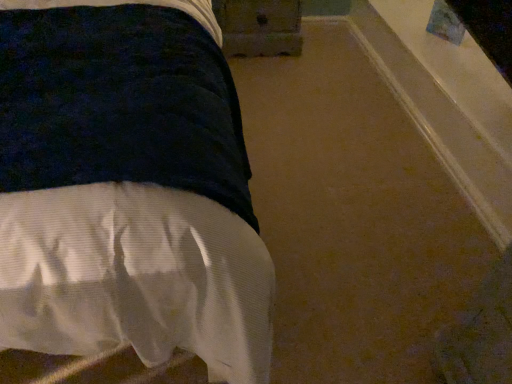
At what (x,y) coordinates should I click in order to perform the action: click on vacant point above white textured bed at left (from a real-world perspective). Please return your answer as a coordinate pair (x, y). The image size is (512, 384). Looking at the image, I should click on (304, 112).